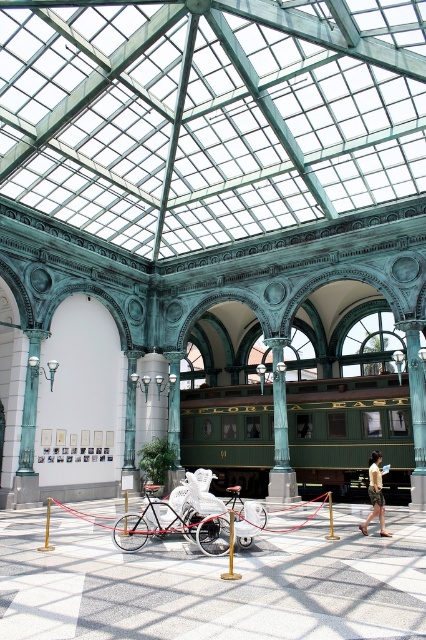
Between green polished wood train car at center and red matte tricycle at center, which one has less height?

red matte tricycle at center is shorter.

Who is positioned more to the left, green polished wood train car at center or red matte tricycle at center?

From the viewer's perspective, red matte tricycle at center appears more on the left side.

Between point (397, 381) and point (164, 525), which one is positioned in front?

Point (164, 525) is more forward.

At what (x,y) coordinates should I click in order to perform the action: click on green polished wood train car at center. Please return your answer as a coordinate pair (x, y). This screenshot has height=640, width=426. Looking at the image, I should click on (x=351, y=433).

Which is behind, point (265, 440) or point (402, 326)?

Positioned behind is point (265, 440).

Based on the photo, who is higher up, green polished wood train car at center or green polished pillar at center?

green polished pillar at center is above.

Is point (184, 404) behind point (423, 490)?

Yes, point (184, 404) is behind point (423, 490).

At what (x,y) coordinates should I click in order to perform the action: click on green polished wood train car at center. Please return your answer as a coordinate pair (x, y). This screenshot has width=426, height=640. Looking at the image, I should click on (351, 433).

Who is positioned more to the left, metallic bicycle at center or green polished pillar at center?

metallic bicycle at center is more to the left.

Which is in front, point (232, 618) or point (408, 330)?

Positioned in front is point (232, 618).

Who is more distant from viewer, (23, 556) or (420, 364)?

Positioned behind is point (420, 364).

I want to click on metallic bicycle at center, so click(213, 582).